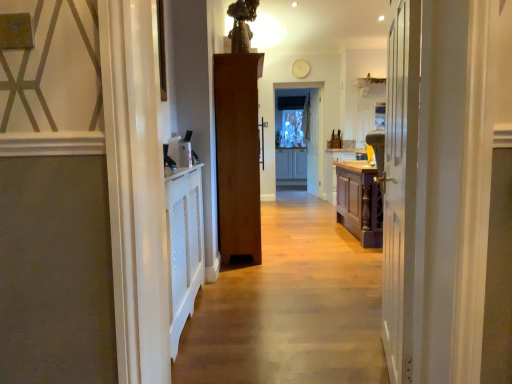
Question: Should I look upward or downward to see clear glass screen door at center?

Choices:
 (A) down
 (B) up

Answer: (B)

Question: Is white wooden door at center, placed as the 3th door when sorted from back to front, directly adjacent to white wooden door at center, the 1th door viewed from the right?

Choices:
 (A) yes
 (B) no

Answer: (B)

Question: From a real-world perspective, does white wooden door at center, the second door in the right-to-left sequence, sit lower than white wooden door at center, the 1th door viewed from the right?

Choices:
 (A) no
 (B) yes

Answer: (B)

Question: Is white wooden door at center, which is counted as the second door, starting from the left, at the left side of white wooden door at center, the 1th door viewed from the right?

Choices:
 (A) no
 (B) yes

Answer: (B)

Question: Considering the relative sizes of white wooden door at center, acting as the first door starting from the front, and white wooden door at center, the third door from the left, in the image provided, is white wooden door at center, acting as the first door starting from the front, shorter than white wooden door at center, the third door from the left,?

Choices:
 (A) yes
 (B) no

Answer: (A)

Question: Is white wooden door at center, acting as the first door starting from the front, not within white wooden door at center, the third door from the left?

Choices:
 (A) yes
 (B) no

Answer: (A)

Question: Is white wooden door at center, acting as the first door starting from the front, facing away from white wooden door at center, the 1th door viewed from the right?

Choices:
 (A) no
 (B) yes

Answer: (A)

Question: Considering the relative positions of wooden cabinet at center and clear glass screen door at center in the image provided, is wooden cabinet at center to the right of clear glass screen door at center from the viewer's perspective?

Choices:
 (A) yes
 (B) no

Answer: (B)

Question: Is wooden cabinet at center positioned in front of clear glass screen door at center?

Choices:
 (A) no
 (B) yes

Answer: (B)

Question: From the image's perspective, is wooden cabinet at center located beneath clear glass screen door at center?

Choices:
 (A) no
 (B) yes

Answer: (B)

Question: Is there a large distance between wooden cabinet at center and clear glass screen door at center?

Choices:
 (A) no
 (B) yes

Answer: (A)

Question: Is wooden cabinet at center outside clear glass screen door at center?

Choices:
 (A) no
 (B) yes

Answer: (B)

Question: Considering the relative sizes of wooden cabinet at center and clear glass screen door at center in the image provided, is wooden cabinet at center taller than clear glass screen door at center?

Choices:
 (A) yes
 (B) no

Answer: (B)

Question: Is clear glass screen door at center further to camera compared to brown wooden door at center, positioned as the 2th door in front-to-back order?

Choices:
 (A) no
 (B) yes

Answer: (B)